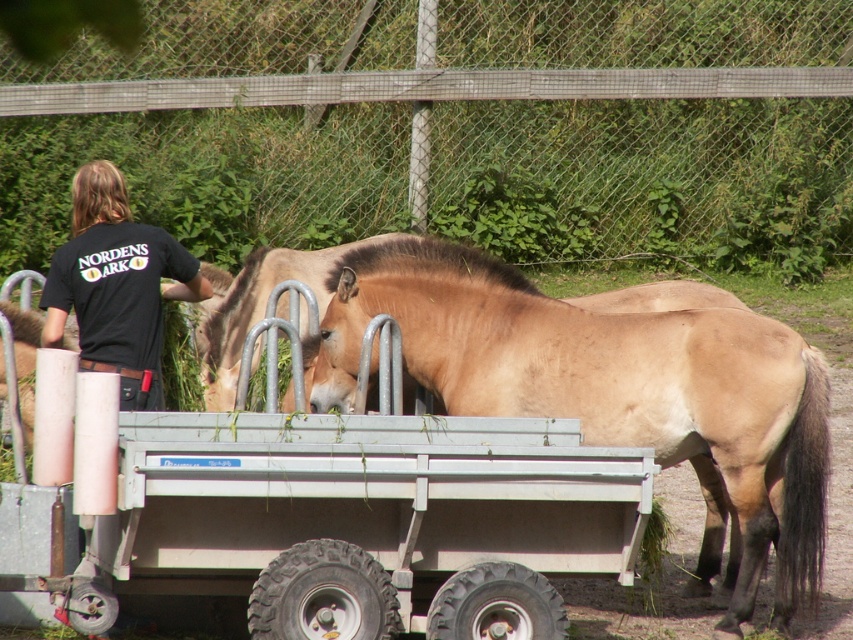
You are a farmer who needs to transport both the metallic silver wagon at center and the black cotton shirt at upper left. Which item requires more space in your pickup truck bed?

The metallic silver wagon at center requires more space in the pickup truck bed because it is bigger than the black cotton shirt at upper left.

You are a farmer who needs to clean the trailer. You see the light brown fur at center and the brown matte horse at center. Which object is closer to the ground?

The light brown fur at center is located below the brown matte horse at center, so it is closer to the ground.